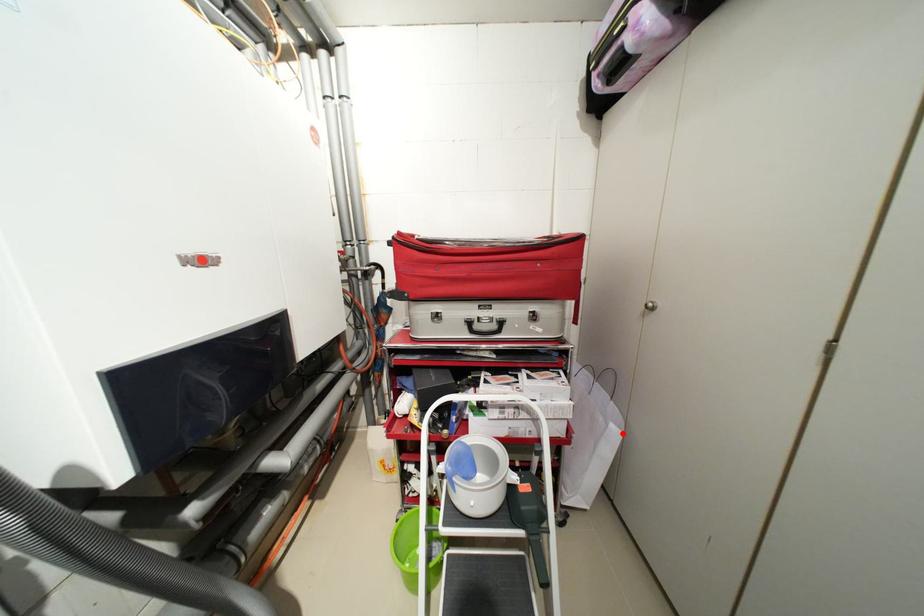
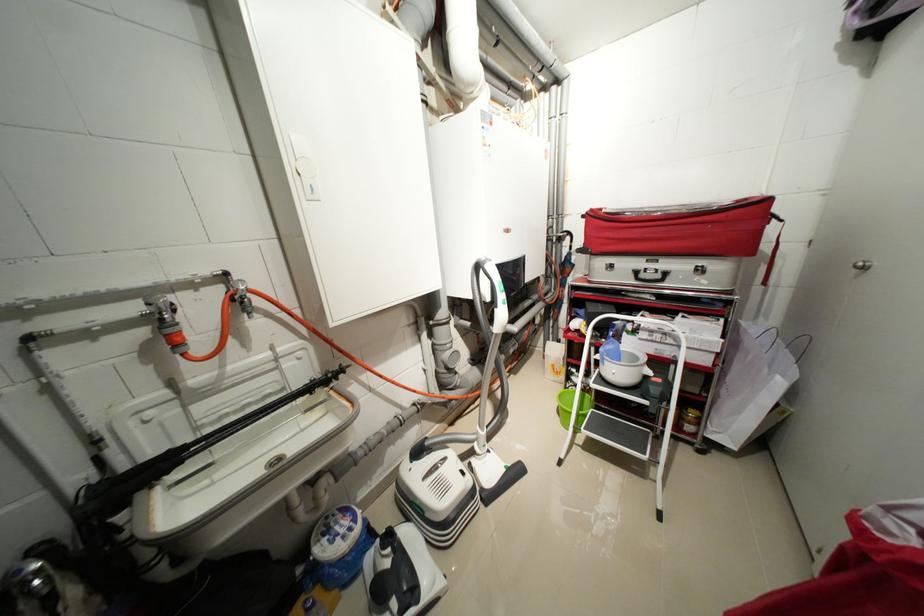
Locate, in the second image, the point that corresponds to the highlighted location in the first image.

(787, 384)